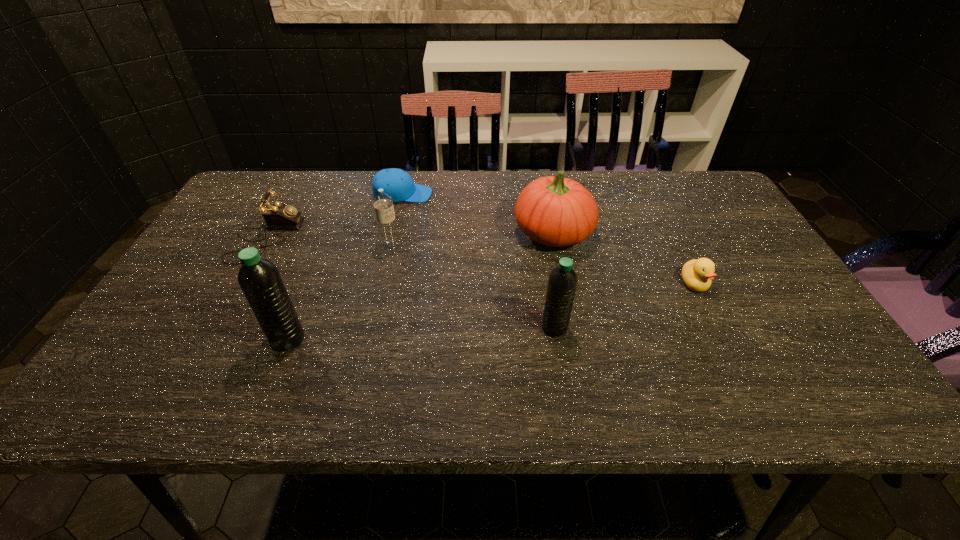
You are a GUI agent. You are given a task and a screenshot of the screen. Output one action in this format:
    pyautogui.click(x=<x>, y=<y>)
    Task: Click on the tallest water bottle
    The width and height of the screenshot is (960, 540).
    Given the screenshot: What is the action you would take?
    pyautogui.click(x=260, y=280)

Find the location of a particular element. the leftmost water bottle is located at coordinates (260, 280).

Locate an element on the screen. the rightmost water bottle is located at coordinates (562, 282).

Locate an element on the screen. The height and width of the screenshot is (540, 960). the second water bottle from left to right is located at coordinates (383, 203).

Identify the location of pumpkin. The width and height of the screenshot is (960, 540). (555, 211).

Where is `cap`? cap is located at coordinates (397, 183).

The width and height of the screenshot is (960, 540). I want to click on telephone, so click(x=277, y=216).

Find the location of a particular element. Image resolution: width=960 pixels, height=540 pixels. the rightmost object is located at coordinates (697, 274).

I want to click on duckling, so click(697, 274).

Where is `vacant space positioned on the right of the sixth object from right to left`? This screenshot has width=960, height=540. vacant space positioned on the right of the sixth object from right to left is located at coordinates (368, 339).